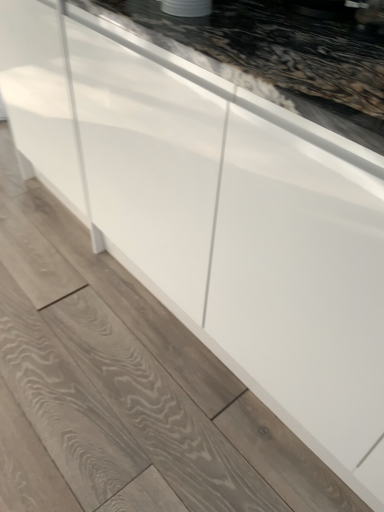
What do you see at coordinates (149, 163) in the screenshot? The height and width of the screenshot is (512, 384). I see `white glossy cabinet at lower left` at bounding box center [149, 163].

Where is `white glossy cabinet at lower left`? white glossy cabinet at lower left is located at coordinates (149, 163).

Find the location of `white glossy cabinet at lower left`. white glossy cabinet at lower left is located at coordinates [149, 163].